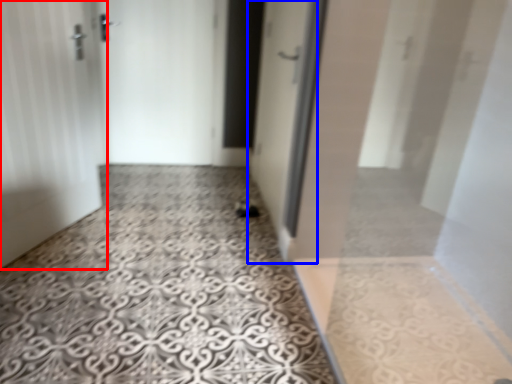
Question: Among these objects, which one is farthest to the camera, door (highlighted by a red box) or door (highlighted by a blue box)?

Choices:
 (A) door
 (B) door

Answer: (B)